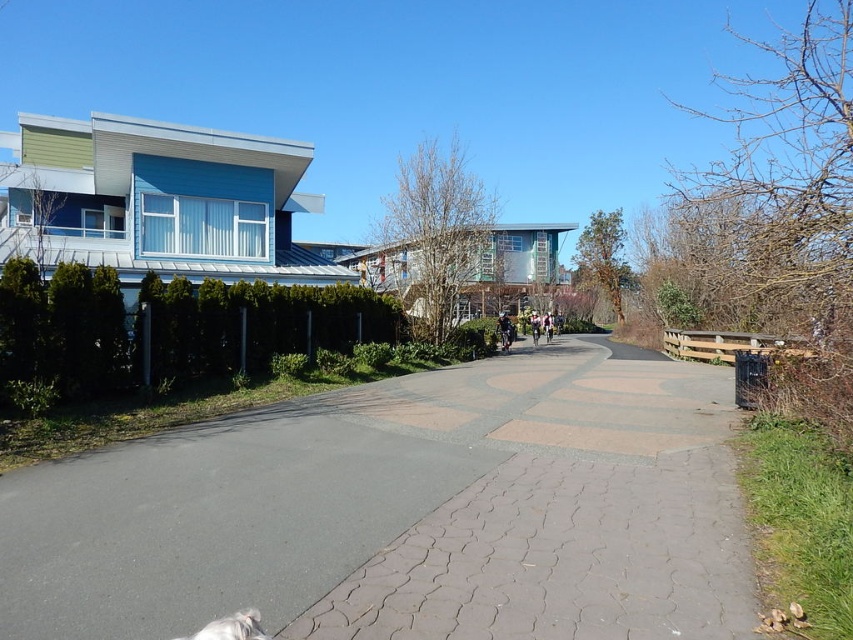
Question: Does white fur dog at lower left appear on the left side of white fabric jacket at center?

Choices:
 (A) no
 (B) yes

Answer: (B)

Question: Observing the image, what is the correct spatial positioning of paved concrete at center in reference to light blue fabric jacket at center?

Choices:
 (A) left
 (B) right

Answer: (A)

Question: Which is nearer to the light blue fabric jacket at center?

Choices:
 (A) white fur dog at lower left
 (B) dark blue jacket at center

Answer: (B)

Question: Which of the following is the closest to the observer?

Choices:
 (A) dark blue jacket at center
 (B) light blue fabric jacket at center
 (C) white fur dog at lower left
 (D) white fabric jacket at center

Answer: (C)

Question: Among these objects, which one is nearest to the camera?

Choices:
 (A) white fur dog at lower left
 (B) dark blue jacket at center

Answer: (A)

Question: Can you confirm if paved concrete at center is positioned above dark blue jacket at center?

Choices:
 (A) no
 (B) yes

Answer: (A)